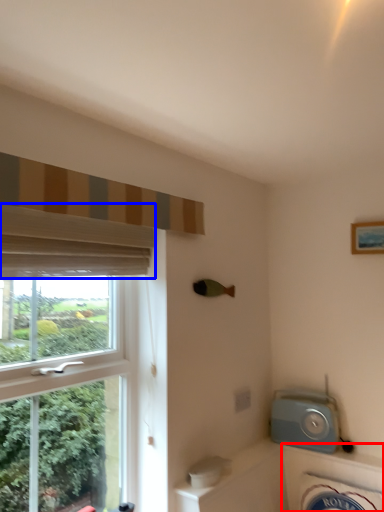
Question: Which point is further to the camera, bath (highlighted by a red box) or curtain (highlighted by a blue box)?

Choices:
 (A) bath
 (B) curtain

Answer: (A)